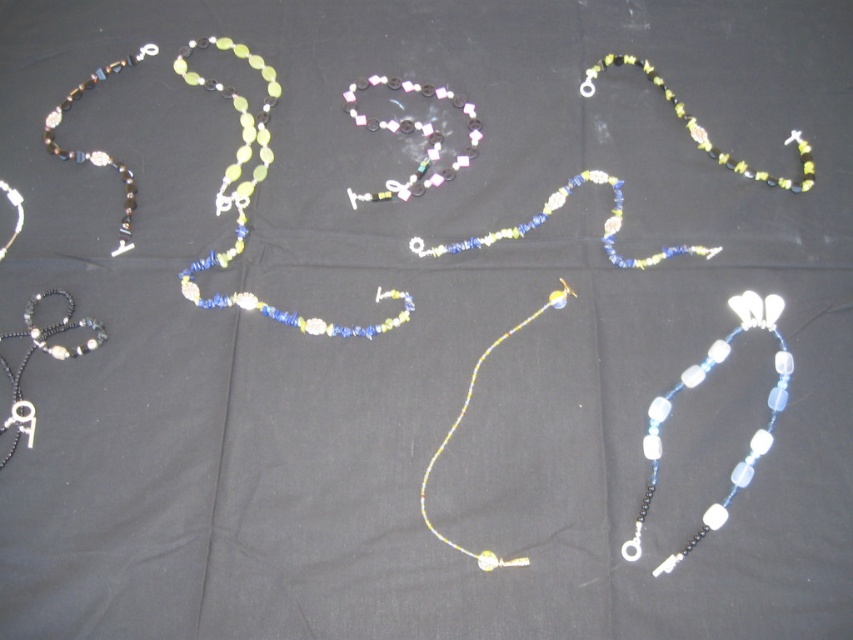
Question: Which point is closer to the camera?

Choices:
 (A) (520, 564)
 (B) (705, 369)
 (C) (805, 179)

Answer: (A)

Question: Does translucent plastic beads at center have a lesser width compared to translucent yellow beads at center?

Choices:
 (A) yes
 (B) no

Answer: (B)

Question: Estimate the real-world distances between objects in this image. Which object is farther from the translucent plastic beads at center?

Choices:
 (A) matte black beads at upper left
 (B) translucent yellow beads at center
 (C) translucent yellow glass beads at center

Answer: (A)

Question: Does matte black necklace at lower left appear under translucent yellow beads at center?

Choices:
 (A) yes
 (B) no

Answer: (B)

Question: Which point is farther to the camera?

Choices:
 (A) matte black beads at upper left
 (B) translucent blue glass beads at lower right
 (C) matte black necklace at lower left
 (D) translucent plastic beads at center

Answer: (D)

Question: Is matte black necklace at lower left wider than translucent yellow-green beads at upper right?

Choices:
 (A) yes
 (B) no

Answer: (B)